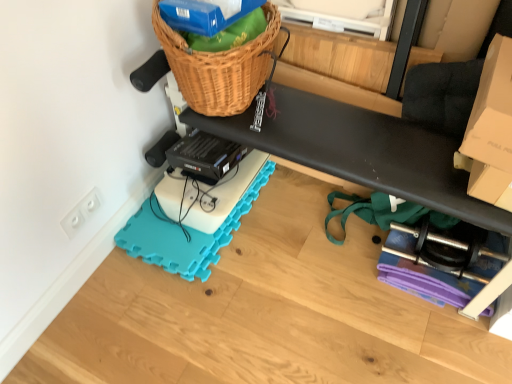
Where is `woven brown basket at upper center`? This screenshot has width=512, height=384. woven brown basket at upper center is located at coordinates (219, 67).

The image size is (512, 384). Describe the element at coordinates (81, 213) in the screenshot. I see `white plastic electrical outlet at lower left` at that location.

At what (x,y) coordinates should I click in order to perform the action: click on teal foam yoga mat at lower left. Please return your answer as a coordinate pair (x, y). This screenshot has height=384, width=512. Looking at the image, I should click on (184, 235).

Is black rubber exercise mat at lower center positioned in front of cardboard box at upper right?

Yes.

Is cardboard box at upper right at the back of black rubber exercise mat at lower center?

No, black rubber exercise mat at lower center is not facing away from cardboard box at upper right.

From the image's perspective, is black rubber exercise mat at lower center above or below cardboard box at upper right?

Based on their image positions, black rubber exercise mat at lower center is located beneath cardboard box at upper right.

Based on the photo, is woven brown basket at upper center next to black rubber exercise mat at lower center and touching it?

They are not placed beside each other.

Would you say woven brown basket at upper center is outside black rubber exercise mat at lower center?

Yes, woven brown basket at upper center is not within black rubber exercise mat at lower center.

Is point (192, 59) positioned before point (347, 39)?

Yes.

From a real-world perspective, is teal foam yoga mat at lower left positioned above or below black rubber exercise mat at lower center?

From a real-world perspective, teal foam yoga mat at lower left is physically above black rubber exercise mat at lower center.

Which object is further away from the camera, teal foam yoga mat at lower left or black rubber exercise mat at lower center?

Positioned behind is teal foam yoga mat at lower left.

From the image's perspective, which one is positioned lower, teal foam yoga mat at lower left or black rubber exercise mat at lower center?

From the image's view, black rubber exercise mat at lower center is below.

Is teal foam yoga mat at lower left not near black rubber exercise mat at lower center?

No, teal foam yoga mat at lower left is in close proximity to black rubber exercise mat at lower center.

From the image's perspective, between teal foam yoga mat at lower left and cardboard box at upper right, who is located below?

teal foam yoga mat at lower left is shown below in the image.

Is teal foam yoga mat at lower left in front of or behind cardboard box at upper right in the image?

Visually, teal foam yoga mat at lower left is located behind cardboard box at upper right.

Can you confirm if teal foam yoga mat at lower left is positioned to the right of cardboard box at upper right?

Incorrect, teal foam yoga mat at lower left is not on the right side of cardboard box at upper right.

The height and width of the screenshot is (384, 512). In order to click on yoga mat below the cardboard box at upper right (from a real-world perspective) in this screenshot , I will do `click(184, 235)`.

Is cardboard box at upper right bigger or smaller than teal foam yoga mat at lower left?

cardboard box at upper right is bigger than teal foam yoga mat at lower left.

Can you tell me how much cardboard box at upper right and teal foam yoga mat at lower left differ in facing direction?

The facing directions of cardboard box at upper right and teal foam yoga mat at lower left are 0.402 degrees apart.

Can teal foam yoga mat at lower left be found inside cardboard box at upper right?

No, teal foam yoga mat at lower left is not a part of cardboard box at upper right.

Is teal foam yoga mat at lower left taller or shorter than white plastic electrical outlet at lower left?

In the image, teal foam yoga mat at lower left appears to be shorter than white plastic electrical outlet at lower left.

The height and width of the screenshot is (384, 512). I want to click on yoga mat behind the white plastic electrical outlet at lower left, so click(184, 235).

From a real-world perspective, is teal foam yoga mat at lower left beneath white plastic electrical outlet at lower left?

Yes, from a real-world perspective, teal foam yoga mat at lower left is under white plastic electrical outlet at lower left.

Which is behind, point (205, 236) or point (64, 226)?

Positioned behind is point (205, 236).

Can you confirm if white plastic electrical outlet at lower left is bigger than cardboard box at upper right?

Actually, white plastic electrical outlet at lower left might be smaller than cardboard box at upper right.

From a real-world perspective, which is physically below, white plastic electrical outlet at lower left or cardboard box at upper right?

From a 3D spatial view, white plastic electrical outlet at lower left is below.

In the image, there is a cardboard box at upper right. Where is `furniture below it (from a real-world perspective)`? This screenshot has width=512, height=384. furniture below it (from a real-world perspective) is located at coordinates (365, 70).

This screenshot has height=384, width=512. Identify the location of furniture below the woven brown basket at upper center (from the image's perspective). (365, 70).

From the image, which object appears to be nearer to teal foam yoga mat at lower left, black rubber exercise mat at lower center or cardboard box at upper right?

black rubber exercise mat at lower center is closer to teal foam yoga mat at lower left.

Which object lies nearer to the anchor point white plastic electrical outlet at lower left, teal foam yoga mat at lower left or black rubber exercise mat at lower center?

teal foam yoga mat at lower left.

When comparing their distances from teal foam yoga mat at lower left, does white plastic electrical outlet at lower left or cardboard box at upper right seem further?

Based on the image, cardboard box at upper right appears to be further to teal foam yoga mat at lower left.

Consider the image. From the image, which object appears to be farther from white plastic electrical outlet at lower left, cardboard box at upper right or woven brown basket at upper center?

cardboard box at upper right lies further to white plastic electrical outlet at lower left than the other object.

Considering their positions, is woven brown basket at upper center positioned closer to white plastic electrical outlet at lower left than teal foam yoga mat at lower left?

The object closer to white plastic electrical outlet at lower left is teal foam yoga mat at lower left.

Based on their spatial positions, is cardboard box at upper right or teal foam yoga mat at lower left further from woven brown basket at upper center?

cardboard box at upper right.

Based on their spatial positions, is teal foam yoga mat at lower left or woven brown basket at upper center further from cardboard box at upper right?

Among the two, teal foam yoga mat at lower left is located further to cardboard box at upper right.

From the image, which object appears to be farther from teal foam yoga mat at lower left, white plastic electrical outlet at lower left or black rubber exercise mat at lower center?

Based on the image, black rubber exercise mat at lower center appears to be further to teal foam yoga mat at lower left.

Identify the location of yoga mat that lies between woven brown basket at upper center and white plastic electrical outlet at lower left from top to bottom. Image resolution: width=512 pixels, height=384 pixels. (184, 235).

The height and width of the screenshot is (384, 512). Find the location of `basket between teal foam yoga mat at lower left and cardboard box at upper right in the horizontal direction`. basket between teal foam yoga mat at lower left and cardboard box at upper right in the horizontal direction is located at coordinates (219, 67).

Where is `yoga mat between white plastic electrical outlet at lower left and black rubber exercise mat at lower center`? This screenshot has height=384, width=512. yoga mat between white plastic electrical outlet at lower left and black rubber exercise mat at lower center is located at coordinates (184, 235).

Locate an element on the screen. The width and height of the screenshot is (512, 384). basket between white plastic electrical outlet at lower left and black rubber exercise mat at lower center is located at coordinates (219, 67).